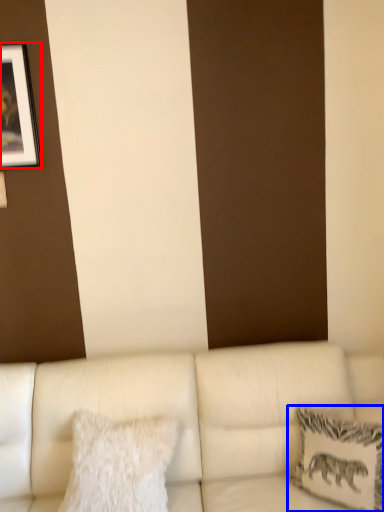
Question: Which object is further to the camera taking this photo, picture frame (highlighted by a red box) or pillow (highlighted by a blue box)?

Choices:
 (A) picture frame
 (B) pillow

Answer: (A)